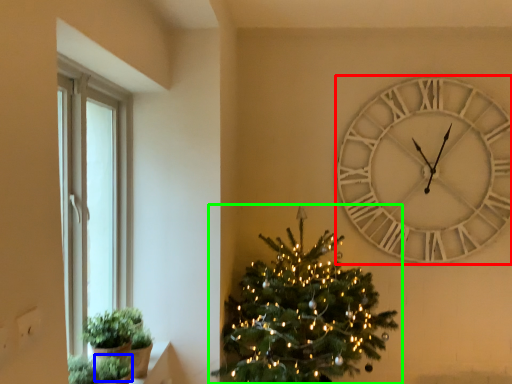
Question: Which is nearer to the wall clock (highlighted by a red box)? plant (highlighted by a blue box) or christmas tree (highlighted by a green box).

Choices:
 (A) plant
 (B) christmas tree

Answer: (B)